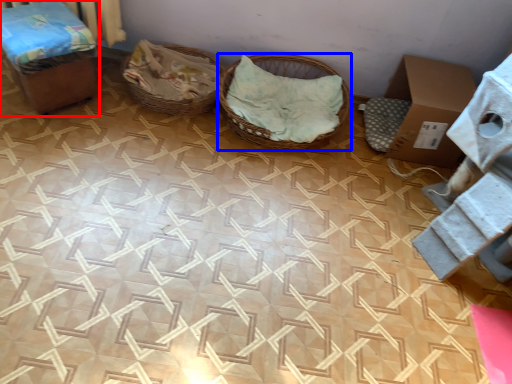
Question: Which point is closer to the camera, furniture (highlighted by a red box) or basket (highlighted by a blue box)?

Choices:
 (A) furniture
 (B) basket

Answer: (A)